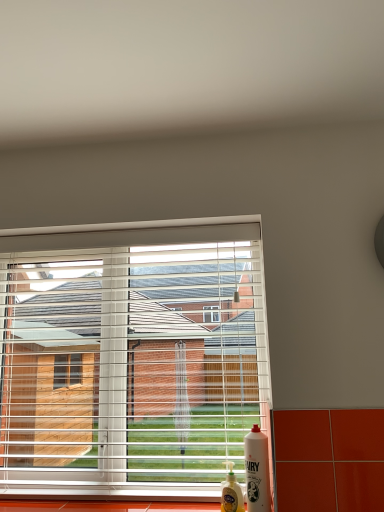
Describe the element at coordinates (130, 356) in the screenshot. I see `white plastic blinds at center` at that location.

This screenshot has height=512, width=384. Describe the element at coordinates (257, 470) in the screenshot. I see `white glossy fairy liquid at lower right, acting as the 1th bottle starting from the right` at that location.

You are a GUI agent. You are given a task and a screenshot of the screen. Output one action in this format:
    pyautogui.click(x=<x>, y=<y>)
    Task: Click on the white plastic blinds at center
    
    Given the screenshot: What is the action you would take?
    pyautogui.click(x=130, y=356)

From the image's perspective, which is above, translucent plastic bottle at lower right, which is the second bottle from right to left, or white plastic blinds at center?

white plastic blinds at center, from the image's perspective.

At what (x,y) coordinates should I click in order to perform the action: click on window above the translucent plastic bottle at lower right, the first bottle from the left (from the image's perspective). Please return your answer as a coordinate pair (x, y). Looking at the image, I should click on (130, 356).

Visually, is translucent plastic bottle at lower right, which is the second bottle from right to left, positioned to the left or to the right of white plastic blinds at center?

translucent plastic bottle at lower right, which is the second bottle from right to left, is positioned on white plastic blinds at center's right side.

Does translucent plastic bottle at lower right, which is the second bottle from right to left, lie behind white plastic blinds at center?

No.

Find the location of a particular element. The height and width of the screenshot is (512, 384). window located behind the translucent plastic bottle at lower right, the first bottle from the left is located at coordinates (130, 356).

From the image's perspective, is white plastic blinds at center above or below translucent plastic bottle at lower right, the first bottle from the left?

Based on their image positions, white plastic blinds at center is located above translucent plastic bottle at lower right, the first bottle from the left.

Is white plastic blinds at center wider than translucent plastic bottle at lower right, the first bottle from the left?

Indeed, white plastic blinds at center has a greater width compared to translucent plastic bottle at lower right, the first bottle from the left.

Is the depth of white plastic blinds at center greater than that of translucent plastic bottle at lower right, which is the second bottle from right to left?

Yes, the depth of white plastic blinds at center is greater than that of translucent plastic bottle at lower right, which is the second bottle from right to left.

Would you say white glossy fairy liquid at lower right, the second bottle viewed from the left, contains translucent plastic bottle at lower right, the first bottle from the left?

No, translucent plastic bottle at lower right, the first bottle from the left, is not surrounded by white glossy fairy liquid at lower right, the second bottle viewed from the left.

Considering the relative positions of white glossy fairy liquid at lower right, acting as the 1th bottle starting from the right, and translucent plastic bottle at lower right, which is the second bottle from right to left, in the image provided, is white glossy fairy liquid at lower right, acting as the 1th bottle starting from the right, to the right of translucent plastic bottle at lower right, which is the second bottle from right to left, from the viewer's perspective?

Correct, you'll find white glossy fairy liquid at lower right, acting as the 1th bottle starting from the right, to the right of translucent plastic bottle at lower right, which is the second bottle from right to left.

Which of these two, white glossy fairy liquid at lower right, acting as the 1th bottle starting from the right, or translucent plastic bottle at lower right, which is the second bottle from right to left, is thinner?

Thinner between the two is translucent plastic bottle at lower right, which is the second bottle from right to left.

Considering the sizes of objects white glossy fairy liquid at lower right, acting as the 1th bottle starting from the right, and translucent plastic bottle at lower right, which is the second bottle from right to left, in the image provided, who is smaller, white glossy fairy liquid at lower right, acting as the 1th bottle starting from the right, or translucent plastic bottle at lower right, which is the second bottle from right to left,?

Smaller between the two is translucent plastic bottle at lower right, which is the second bottle from right to left.

Is white glossy fairy liquid at lower right, acting as the 1th bottle starting from the right, aimed at white plastic blinds at center?

No, white glossy fairy liquid at lower right, acting as the 1th bottle starting from the right, is not turned towards white plastic blinds at center.

Is white glossy fairy liquid at lower right, acting as the 1th bottle starting from the right, situated inside white plastic blinds at center or outside?

white glossy fairy liquid at lower right, acting as the 1th bottle starting from the right, is outside white plastic blinds at center.

Between white glossy fairy liquid at lower right, the second bottle viewed from the left, and white plastic blinds at center, which one has more height?

white plastic blinds at center.

Is white glossy fairy liquid at lower right, the second bottle viewed from the left, to the left of white plastic blinds at center from the viewer's perspective?

No.

Is point (44, 273) closer to camera compared to point (257, 456)?

No, (44, 273) is further to viewer.

Considering the positions of objects white plastic blinds at center and white glossy fairy liquid at lower right, the second bottle viewed from the left, in the image provided, who is in front, white plastic blinds at center or white glossy fairy liquid at lower right, the second bottle viewed from the left,?

white glossy fairy liquid at lower right, the second bottle viewed from the left, is in front.

In the scene shown: Considering the relative positions of white plastic blinds at center and white glossy fairy liquid at lower right, acting as the 1th bottle starting from the right, in the image provided, is white plastic blinds at center to the left of white glossy fairy liquid at lower right, acting as the 1th bottle starting from the right, from the viewer's perspective?

Yes, white plastic blinds at center is to the left of white glossy fairy liquid at lower right, acting as the 1th bottle starting from the right.

Between translucent plastic bottle at lower right, which is the second bottle from right to left, and white glossy fairy liquid at lower right, the second bottle viewed from the left, which one is positioned behind?

translucent plastic bottle at lower right, which is the second bottle from right to left, is further from the camera.

From a real-world perspective, which is physically below, translucent plastic bottle at lower right, which is the second bottle from right to left, or white glossy fairy liquid at lower right, acting as the 1th bottle starting from the right?

translucent plastic bottle at lower right, which is the second bottle from right to left, is physically lower.

In the scene shown: Does translucent plastic bottle at lower right, the first bottle from the left, have a lesser width compared to white glossy fairy liquid at lower right, acting as the 1th bottle starting from the right?

Yes.

Are translucent plastic bottle at lower right, which is the second bottle from right to left, and white glossy fairy liquid at lower right, acting as the 1th bottle starting from the right, making contact?

Yes, translucent plastic bottle at lower right, which is the second bottle from right to left, is beside white glossy fairy liquid at lower right, acting as the 1th bottle starting from the right.

This screenshot has width=384, height=512. Find the location of `window to the left of translucent plastic bottle at lower right, the first bottle from the left`. window to the left of translucent plastic bottle at lower right, the first bottle from the left is located at coordinates coord(130,356).

Identify the location of the 2nd bottle below when counting from the white plastic blinds at center (from the image's perspective). The width and height of the screenshot is (384, 512). (231, 492).

From the image, which object appears to be farther from translucent plastic bottle at lower right, which is the second bottle from right to left, white plastic blinds at center or white glossy fairy liquid at lower right, acting as the 1th bottle starting from the right?

white plastic blinds at center is positioned further to the anchor translucent plastic bottle at lower right, which is the second bottle from right to left.

Considering their positions, is translucent plastic bottle at lower right, the first bottle from the left, positioned further to white plastic blinds at center than white glossy fairy liquid at lower right, the second bottle viewed from the left?

translucent plastic bottle at lower right, the first bottle from the left, lies further to white plastic blinds at center than the other object.

Which object lies nearer to the anchor point white glossy fairy liquid at lower right, acting as the 1th bottle starting from the right, translucent plastic bottle at lower right, which is the second bottle from right to left, or white plastic blinds at center?

Among the two, translucent plastic bottle at lower right, which is the second bottle from right to left, is located nearer to white glossy fairy liquid at lower right, acting as the 1th bottle starting from the right.

From the image, which object appears to be farther from white glossy fairy liquid at lower right, acting as the 1th bottle starting from the right, white plastic blinds at center or translucent plastic bottle at lower right, which is the second bottle from right to left?

Based on the image, white plastic blinds at center appears to be further to white glossy fairy liquid at lower right, acting as the 1th bottle starting from the right.

Which object lies nearer to the anchor point translucent plastic bottle at lower right, which is the second bottle from right to left, white glossy fairy liquid at lower right, acting as the 1th bottle starting from the right, or white plastic blinds at center?

Among the two, white glossy fairy liquid at lower right, acting as the 1th bottle starting from the right, is located nearer to translucent plastic bottle at lower right, which is the second bottle from right to left.

When comparing their distances from white plastic blinds at center, does white glossy fairy liquid at lower right, the second bottle viewed from the left, or translucent plastic bottle at lower right, the first bottle from the left, seem closer?

white glossy fairy liquid at lower right, the second bottle viewed from the left.

I want to click on bottle situated between white plastic blinds at center and white glossy fairy liquid at lower right, acting as the 1th bottle starting from the right, from left to right, so click(231, 492).